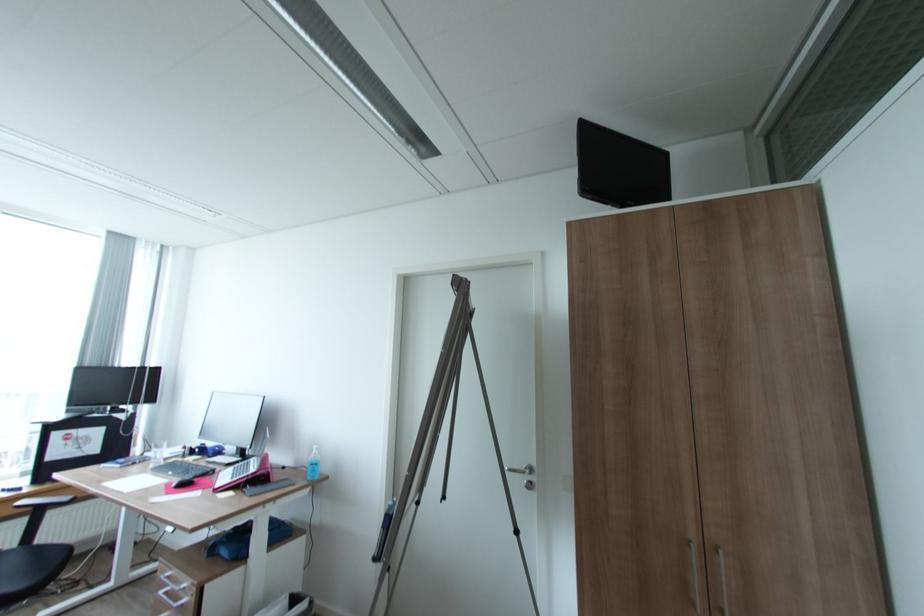
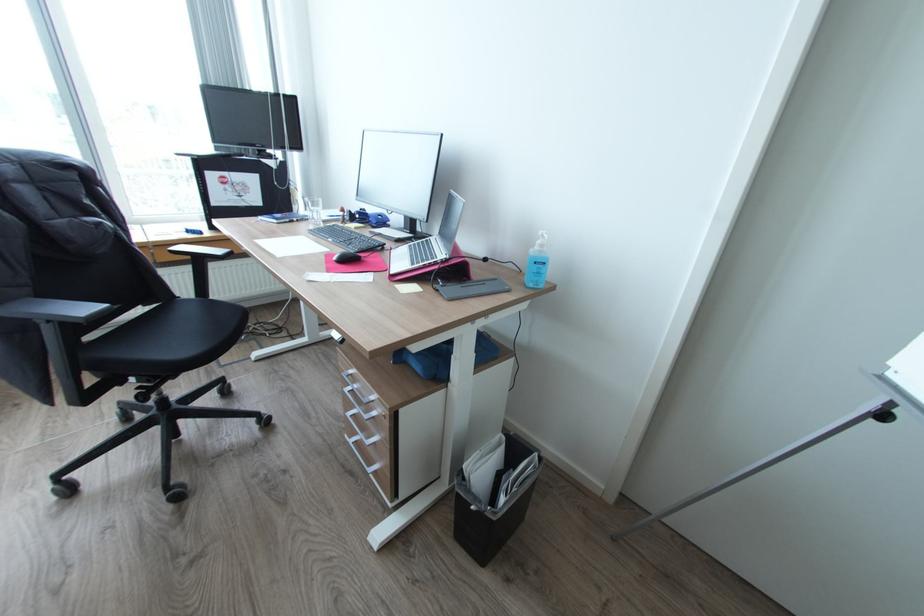
Find the pixel in the second image that matches the point at 252,461 in the first image.

(432, 238)